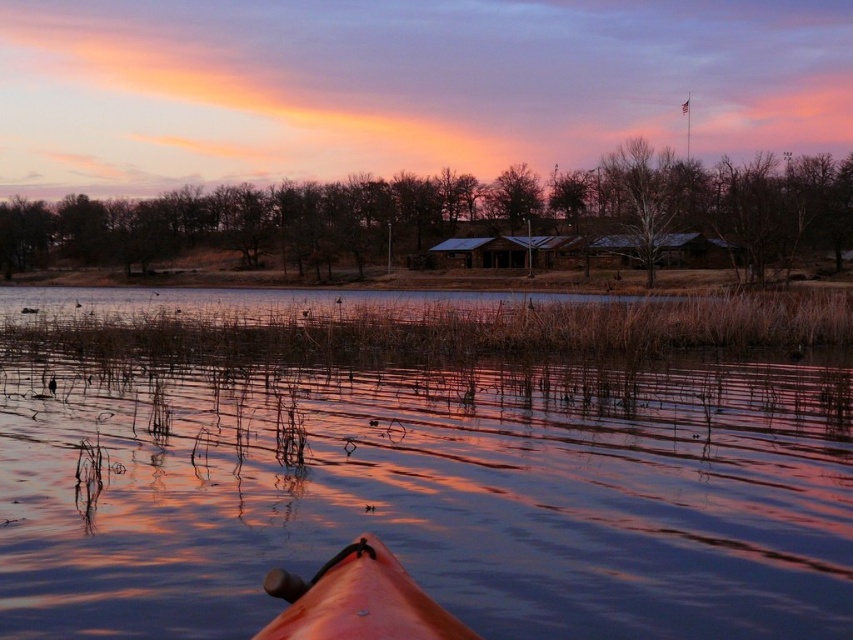
Question: Can you confirm if smooth water at center is positioned to the left of orange matte kayak at lower center?

Choices:
 (A) yes
 (B) no

Answer: (A)

Question: Which point is closer to the camera?

Choices:
 (A) smooth water at center
 (B) orange matte kayak at lower center

Answer: (B)

Question: Which object appears farthest from the camera in this image?

Choices:
 (A) orange matte kayak at lower center
 (B) smooth water at center

Answer: (B)

Question: Is smooth water at center to the right of orange matte kayak at lower center from the viewer's perspective?

Choices:
 (A) no
 (B) yes

Answer: (A)

Question: Where is smooth water at center located in relation to orange matte kayak at lower center in the image?

Choices:
 (A) left
 (B) right

Answer: (A)